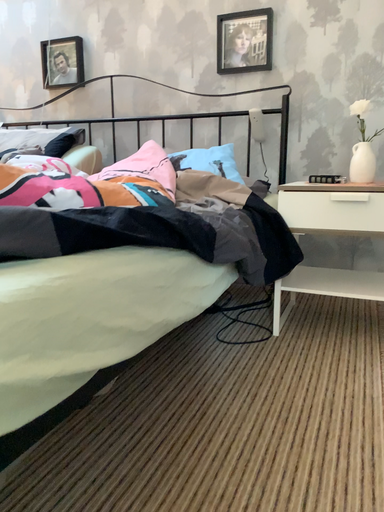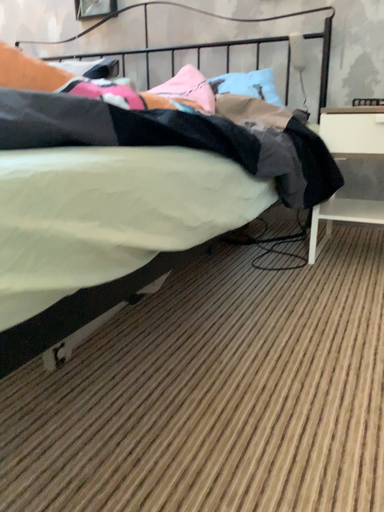
Question: Which way did the camera rotate in the video?

Choices:
 (A) rotated downward
 (B) rotated upward

Answer: (A)